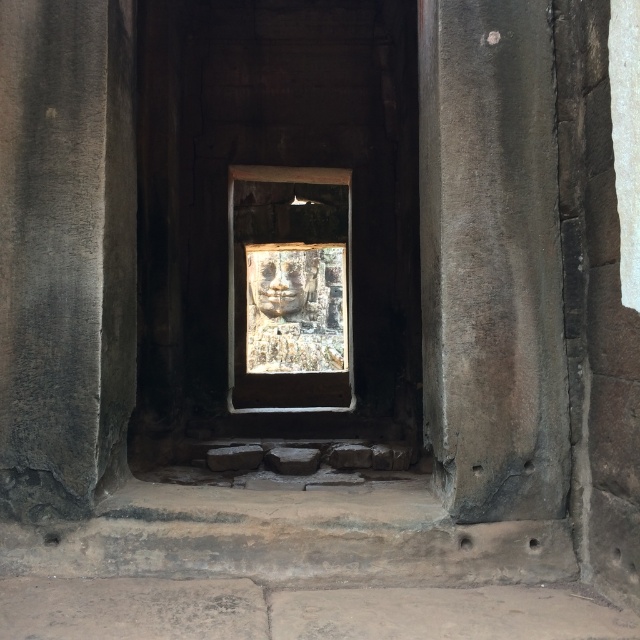
Question: Which of the following is the farthest from the observer?

Choices:
 (A) smooth stone face at center
 (B) gray stone pillar at left
 (C) gray stone pillar at center

Answer: (A)

Question: Which point is farther from the camera taking this photo?

Choices:
 (A) (56, 364)
 (B) (476, 376)
 (C) (275, 262)
 (D) (291, 312)

Answer: (D)

Question: Is gray stone pillar at left above smooth stone face at center?

Choices:
 (A) yes
 (B) no

Answer: (B)

Question: Among these objects, which one is nearest to the camera?

Choices:
 (A) gray stone pillar at left
 (B) stone carving at center
 (C) gray stone pillar at center
 (D) smooth stone face at center

Answer: (A)

Question: Is gray stone pillar at center thinner than gray stone pillar at left?

Choices:
 (A) yes
 (B) no

Answer: (B)

Question: Is gray stone pillar at center to the right of stone carving at center from the viewer's perspective?

Choices:
 (A) yes
 (B) no

Answer: (A)